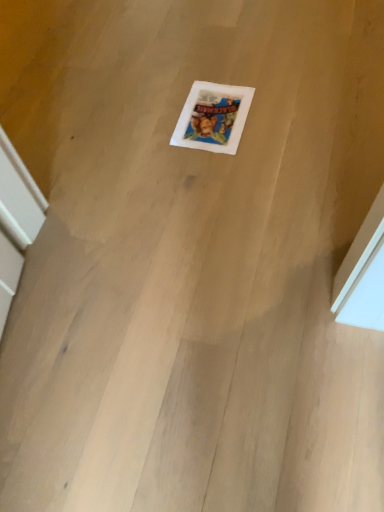
This screenshot has width=384, height=512. I want to click on free space in front of white matte picture frame at center, so coord(227,172).